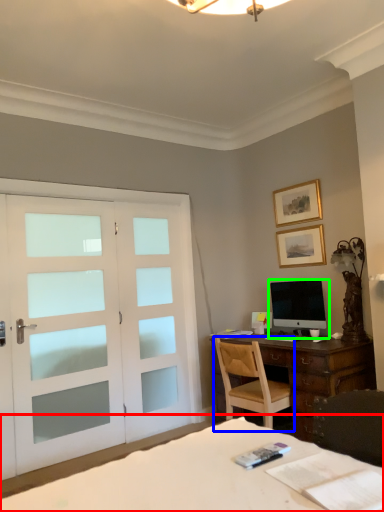
Question: Based on their relative distances, which object is nearer to bed (highlighted by a red box)? Choose from chair (highlighted by a blue box) and computer monitor (highlighted by a green box).

Choices:
 (A) chair
 (B) computer monitor

Answer: (A)